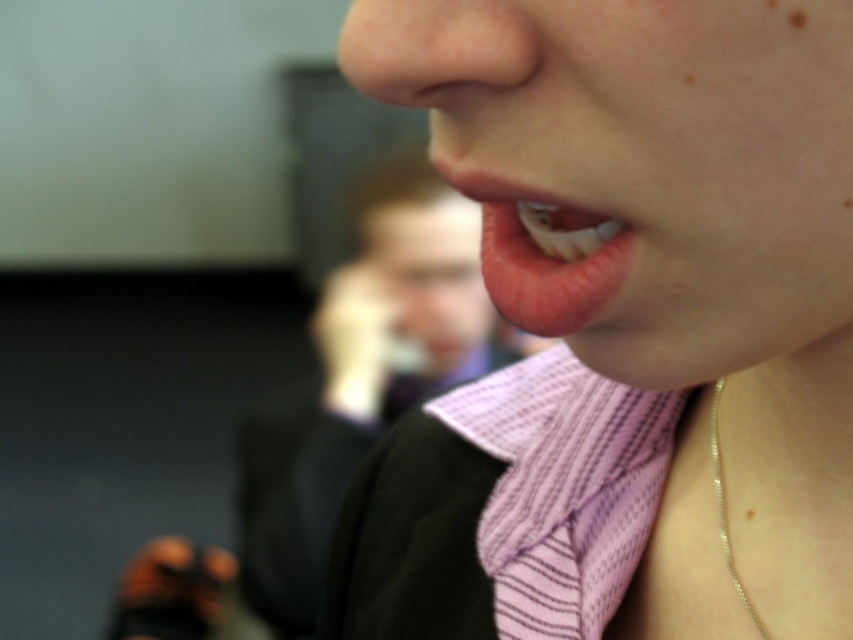
You are a fashion designer observing the image. You need to determine the placement of the pink striped shirt at center and the gold chain at lower right for a new clothing line. Based on the image, which object is positioned to the right side?

The gold chain at lower right is positioned to the right side because the pink striped shirt at center is to the left of it.

You are a photographer adjusting the focus of your camera. You want to ensure both the pink striped shirt at center and the brown matte freckle at upper right are in focus. Based on their positions, which object should you focus on first to achieve this?

The pink striped shirt at center is positioned under the brown matte freckle at upper right. To ensure both are in focus, you should focus on the brown matte freckle at upper right first since it is farther away, allowing the depth of field to cover both objects.